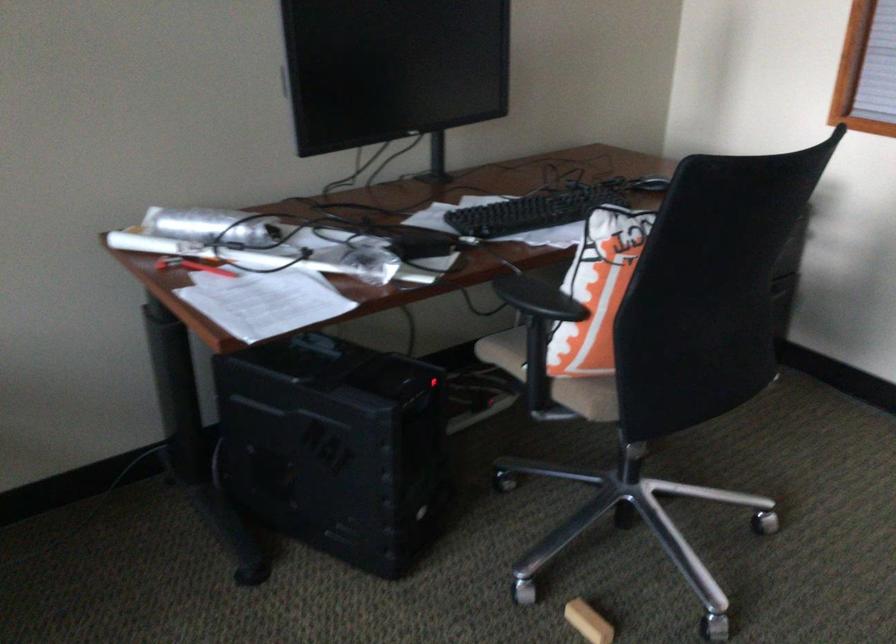
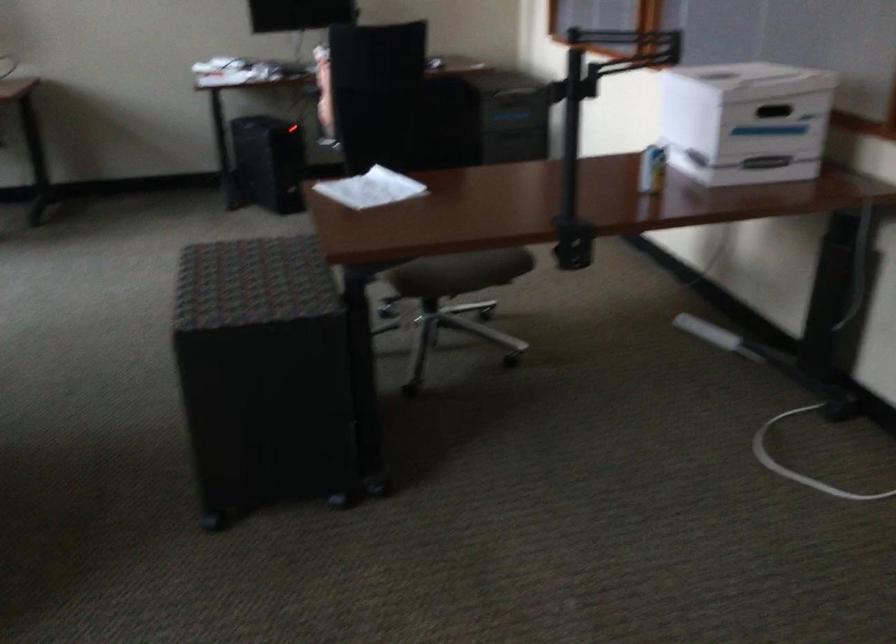
The images are taken continuously from a first-person perspective. In which direction are you moving?

The cameraman moved toward right, backward.